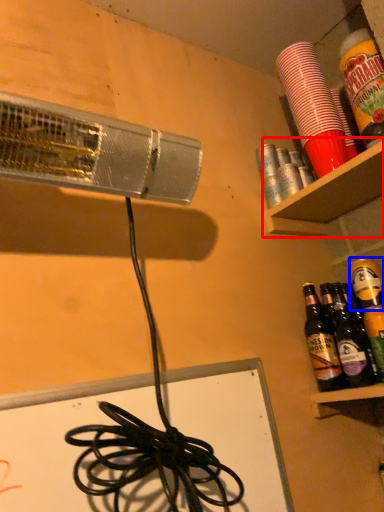
Question: Which point is closer to the camera, shelf (highlighted by a red box) or beer (highlighted by a blue box)?

Choices:
 (A) shelf
 (B) beer

Answer: (A)